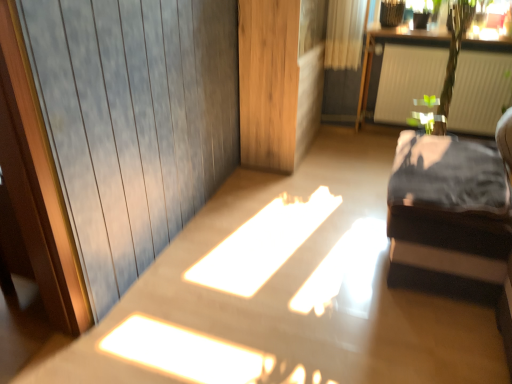
The image size is (512, 384). Identify the location of vacant space to the left of dark gray fabric ottoman at right. (315, 254).